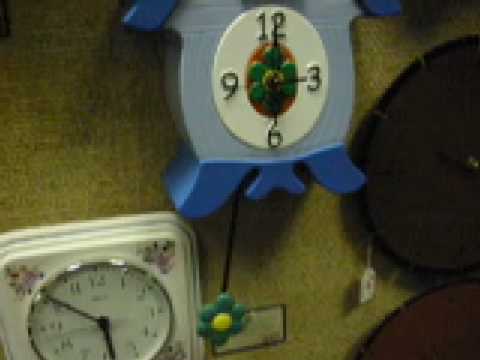
What are the coordinates of `clock hands` in the screenshot? It's located at pos(70,307), pos(108,341), pos(294,79), pos(276,115).